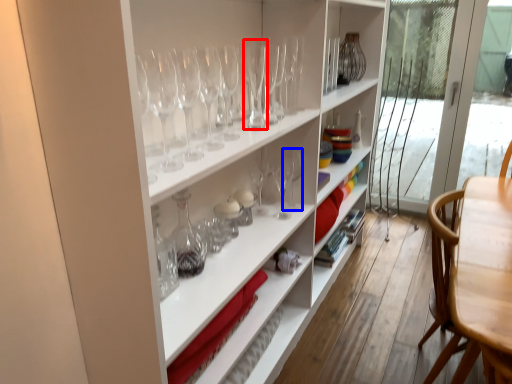
Question: Which object appears closest to the camera in this image, wine glass (highlighted by a red box) or wine glass (highlighted by a blue box)?

Choices:
 (A) wine glass
 (B) wine glass

Answer: (A)